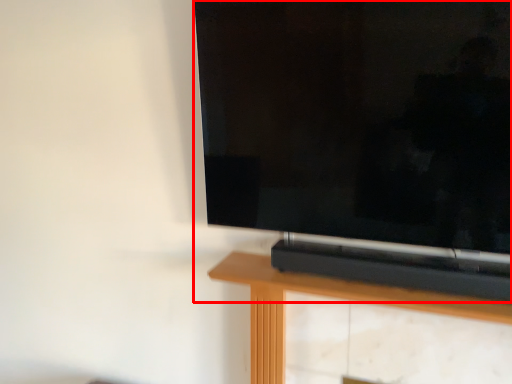
Question: Where is television (annotated by the red box) located in relation to furniture in the image?

Choices:
 (A) right
 (B) left

Answer: (B)